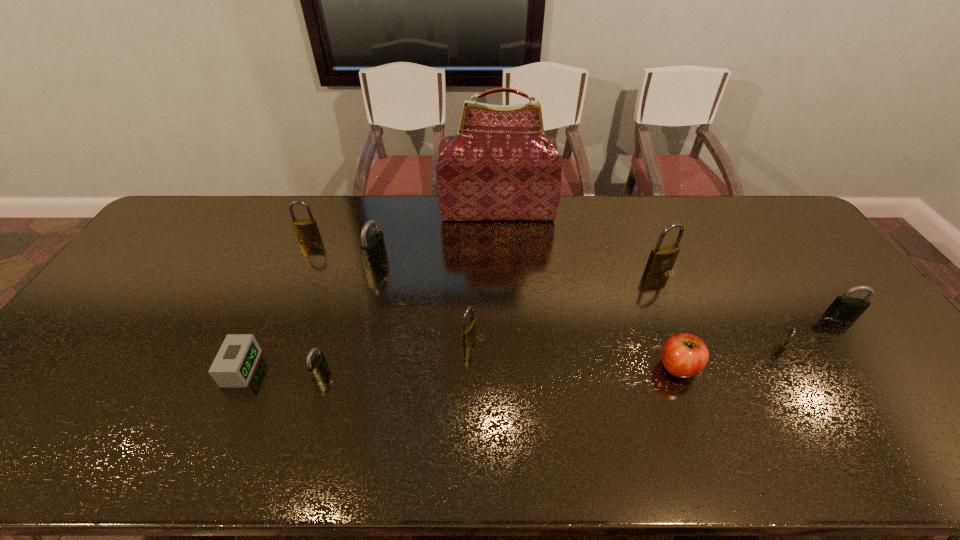
Find the location of a particular element. The width and height of the screenshot is (960, 540). the second closest brass padlock to the biggest black padlock is located at coordinates (468, 331).

At what (x,y) coordinates should I click in order to perform the action: click on black padlock that is the second closest one to the third brass padlock from right to left. Please return your answer as a coordinate pair (x, y). This screenshot has height=540, width=960. Looking at the image, I should click on (373, 250).

I want to click on black padlock that is the closest to the second object from right to left, so click(844, 307).

You are a GUI agent. You are given a task and a screenshot of the screen. Output one action in this format:
    pyautogui.click(x=<x>, y=<y>)
    Task: Click on the vacant region that satisfies the following two spatial constraints: 1. on the back side of the smallest black padlock; 2. on the right side of the second smallest brass padlock
    This screenshot has width=960, height=540.
    Given the screenshot: What is the action you would take?
    [330, 338]

Locate an element on the screen. This screenshot has width=960, height=540. vacant region that satisfies the following two spatial constraints: 1. on the front side of the smallest brass padlock; 2. on the right side of the fourth object from left to right is located at coordinates (353, 351).